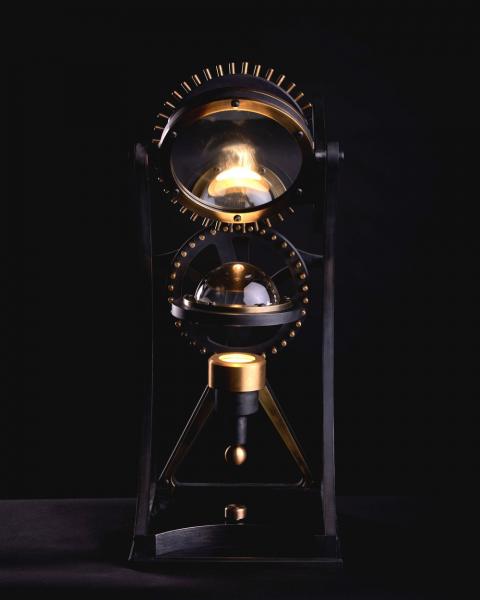
Locate instances of where a coffee mug could be placed in the image. Your answer should be formatted as a list of tuples, i.e. [(x1, y1), (x2, y2), ...], where each tuple contains the x and y coordinates of a point satisfying the conditions above.

[(48, 525)]